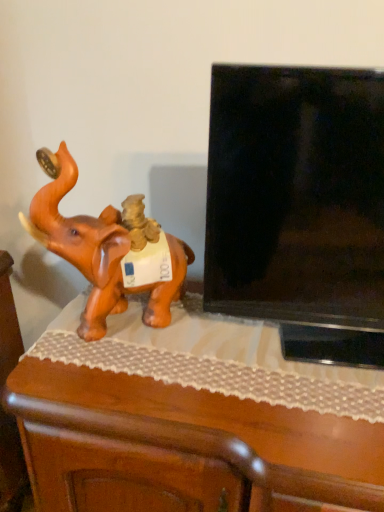
Question: From the image's perspective, is black glossy tv at right located above wooden table at left?

Choices:
 (A) no
 (B) yes

Answer: (B)

Question: Is black glossy tv at right located outside wooden table at left?

Choices:
 (A) yes
 (B) no

Answer: (A)

Question: Are black glossy tv at right and wooden table at left far apart?

Choices:
 (A) no
 (B) yes

Answer: (A)

Question: Can you confirm if black glossy tv at right is smaller than wooden table at left?

Choices:
 (A) no
 (B) yes

Answer: (B)

Question: From the image's perspective, would you say black glossy tv at right is shown under wooden table at left?

Choices:
 (A) no
 (B) yes

Answer: (A)

Question: From a real-world perspective, is black glossy tv at right under wooden table at left?

Choices:
 (A) no
 (B) yes

Answer: (A)

Question: From a real-world perspective, is black glossy tv at right below orange matte elephant at left?

Choices:
 (A) no
 (B) yes

Answer: (A)

Question: Is black glossy tv at right not inside orange matte elephant at left?

Choices:
 (A) no
 (B) yes

Answer: (B)

Question: From the image's perspective, is black glossy tv at right beneath orange matte elephant at left?

Choices:
 (A) yes
 (B) no

Answer: (B)

Question: Is black glossy tv at right in front of orange matte elephant at left?

Choices:
 (A) yes
 (B) no

Answer: (A)

Question: Does black glossy tv at right lie behind orange matte elephant at left?

Choices:
 (A) yes
 (B) no

Answer: (B)

Question: Does black glossy tv at right have a smaller size compared to orange matte elephant at left?

Choices:
 (A) no
 (B) yes

Answer: (A)

Question: Considering the relative positions of orange matte elephant at left and black glossy tv at right in the image provided, is orange matte elephant at left to the left of black glossy tv at right from the viewer's perspective?

Choices:
 (A) no
 (B) yes

Answer: (B)